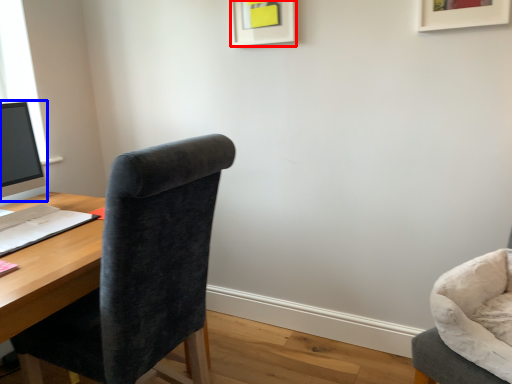
Question: Which of the following is the closest to the observer, picture frame (highlighted by a red box) or computer monitor (highlighted by a blue box)?

Choices:
 (A) picture frame
 (B) computer monitor

Answer: (B)